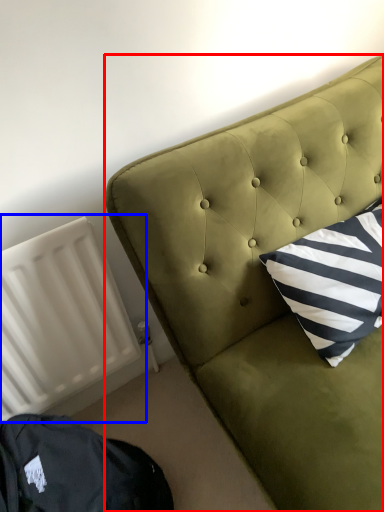
Question: Which point is further to the camera, furniture (highlighted by a red box) or radiator (highlighted by a blue box)?

Choices:
 (A) furniture
 (B) radiator

Answer: (B)